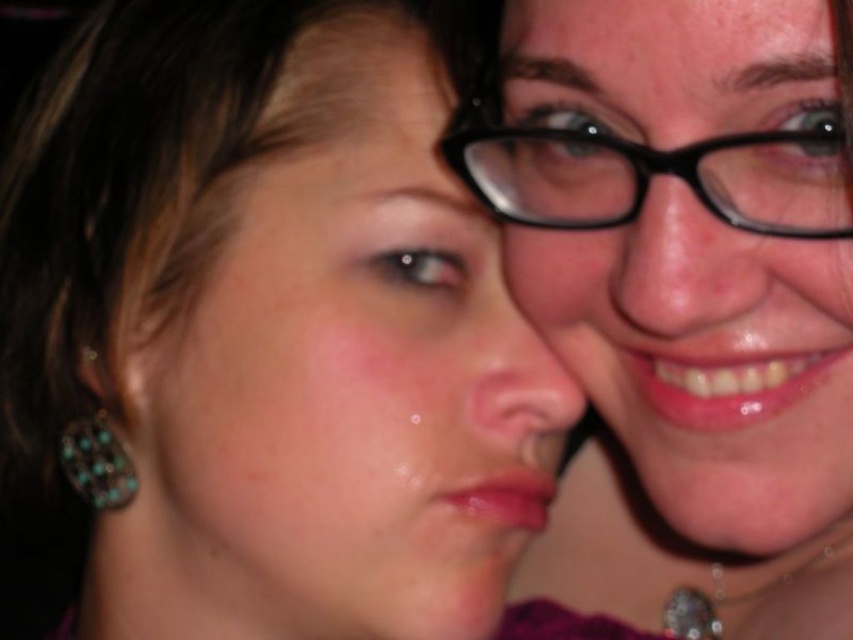
You are a photographer analyzing the composition of this image. The matte black hair at upper left is positioned at a specific coordinate. Can you determine if it is closer to the center of the image or the edge?

The 2D location of matte black hair at upper left is at point (268, 328). Since the coordinates are close to 0.5, which represents the center of the image, the matte black hair at upper left is closer to the center.

Consider the image. You are a photographer who wants to adjust the lighting to highlight both the matte black hair at upper left and the turquoise gemstone earrings at lower left. Considering their sizes, which object should you focus on first to ensure proper exposure?

The matte black hair at upper left has a larger size compared to the turquoise gemstone earrings at lower left, so you should focus on the matte black hair at upper left first to ensure proper exposure since it covers more area and requires adequate lighting.

In the scene shown: You are a photographer adjusting the lighting for a portrait. You notice the matte black hair at upper left and the turquoise gemstone earrings at lower left. Which object should you focus on first if you want to ensure proper exposure for the taller one?

The matte black hair at upper left should be focused on first because it has a greater height compared to the turquoise gemstone earrings at lower left.